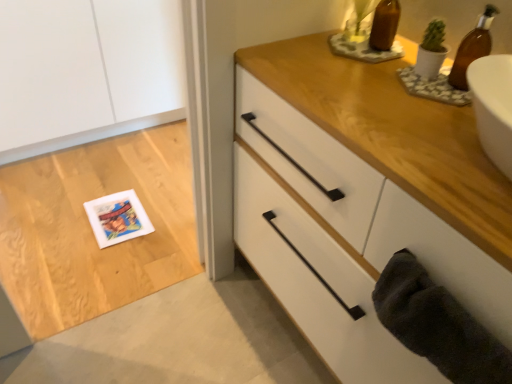
The image size is (512, 384). In order to click on vacant space that is to the left of brown glass bottle at upper right in this screenshot , I will do `click(376, 84)`.